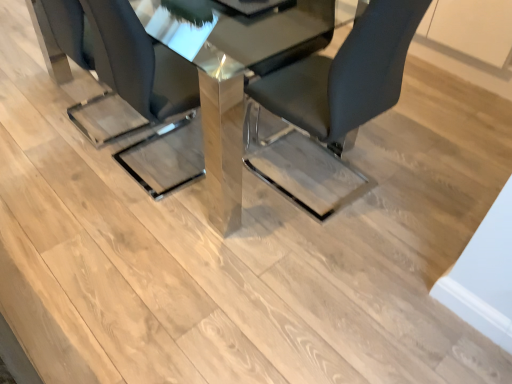
Question: Which direction should I rotate to look at matte black chair at center, which appears as the 2th chair when viewed from the right, — up or down?

Choices:
 (A) down
 (B) up

Answer: (B)

Question: Does polished glass table at center have a smaller size compared to black leather chair at center, which ranks as the second chair in left-to-right order?

Choices:
 (A) no
 (B) yes

Answer: (A)

Question: Is polished glass table at center further to the viewer compared to black leather chair at center, which ranks as the 1th chair in right-to-left order?

Choices:
 (A) yes
 (B) no

Answer: (A)

Question: Does polished glass table at center appear on the left side of black leather chair at center, which ranks as the 1th chair in right-to-left order?

Choices:
 (A) yes
 (B) no

Answer: (A)

Question: Does polished glass table at center turn towards black leather chair at center, which ranks as the 1th chair in right-to-left order?

Choices:
 (A) no
 (B) yes

Answer: (A)

Question: Is polished glass table at center located outside black leather chair at center, which ranks as the 1th chair in right-to-left order?

Choices:
 (A) no
 (B) yes

Answer: (B)

Question: Is polished glass table at center at the right side of black leather chair at center, which ranks as the 1th chair in right-to-left order?

Choices:
 (A) no
 (B) yes

Answer: (A)

Question: Is black leather chair at center, which ranks as the second chair in left-to-right order, facing towards polished glass table at center?

Choices:
 (A) no
 (B) yes

Answer: (B)

Question: Can you confirm if black leather chair at center, which ranks as the second chair in left-to-right order, is positioned to the left of polished glass table at center?

Choices:
 (A) no
 (B) yes

Answer: (A)

Question: From a real-world perspective, is black leather chair at center, which ranks as the second chair in left-to-right order, under polished glass table at center?

Choices:
 (A) no
 (B) yes

Answer: (A)

Question: Is black leather chair at center, which ranks as the second chair in left-to-right order, directly adjacent to polished glass table at center?

Choices:
 (A) yes
 (B) no

Answer: (B)

Question: Does black leather chair at center, which ranks as the second chair in left-to-right order, contain polished glass table at center?

Choices:
 (A) no
 (B) yes

Answer: (A)

Question: Is black leather chair at center, which ranks as the 1th chair in right-to-left order, not close to polished glass table at center?

Choices:
 (A) no
 (B) yes

Answer: (A)

Question: Does matte black chair at center, arranged as the 1th chair when viewed from the left, have a smaller size compared to black leather chair at center, which ranks as the second chair in left-to-right order?

Choices:
 (A) no
 (B) yes

Answer: (B)